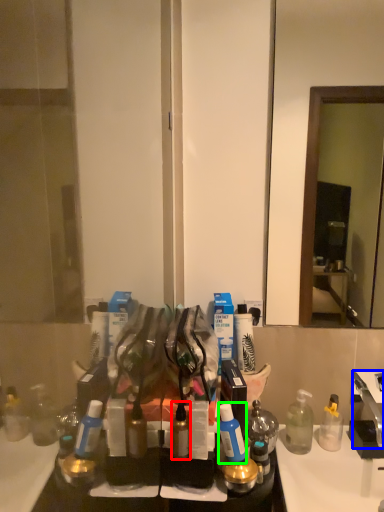
Question: Which object is the closest to the toiletry (highlighted by a red box)? Choose among these: faucet (highlighted by a blue box) or toiletry (highlighted by a green box).

Choices:
 (A) faucet
 (B) toiletry

Answer: (B)